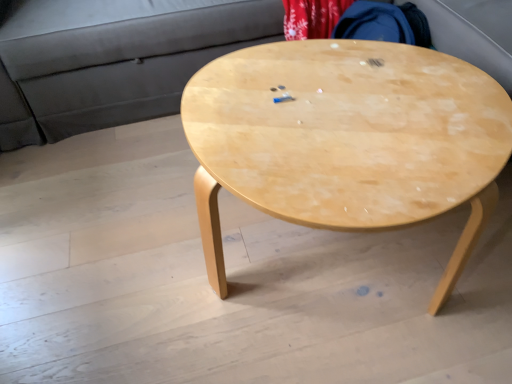
Question: Should I look upward or downward to see light wood/texture coffee table at center?

Choices:
 (A) down
 (B) up

Answer: (B)